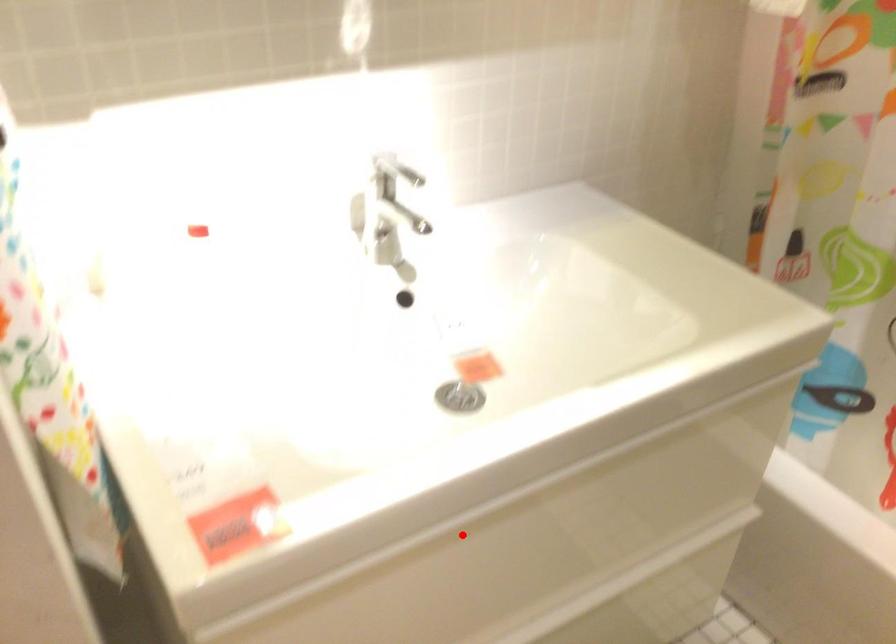
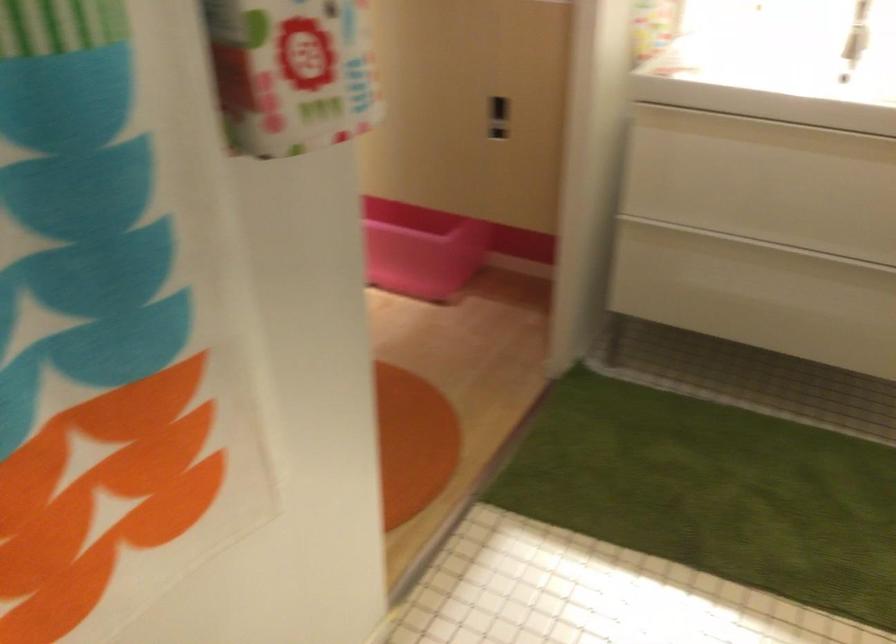
Question: I am providing you with two images of the same scene from different viewpoints. In image1, a red point is highlighted. Considering the same 3D point in image2, which of the following is correct?

Choices:
 (A) It is closer
 (B) It is farther

Answer: (B)